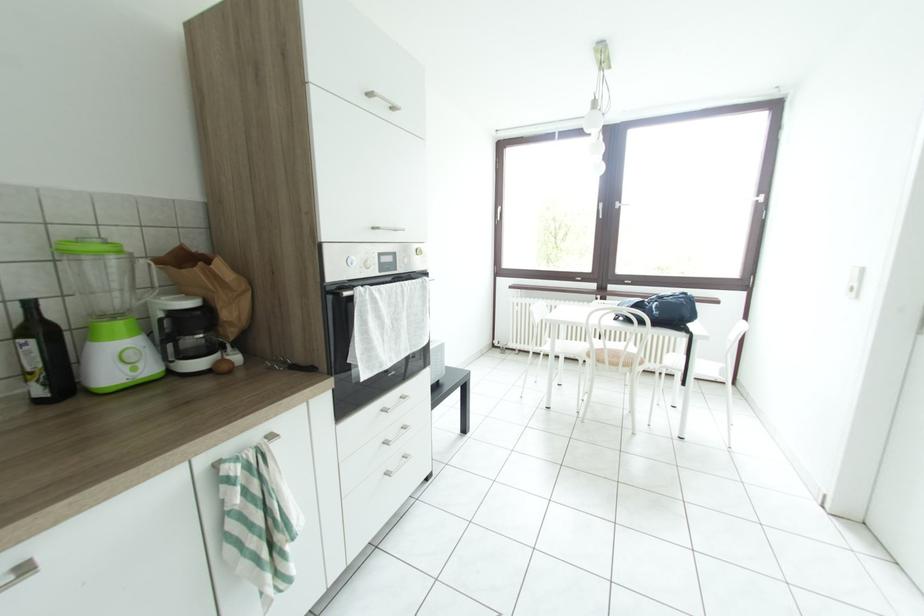
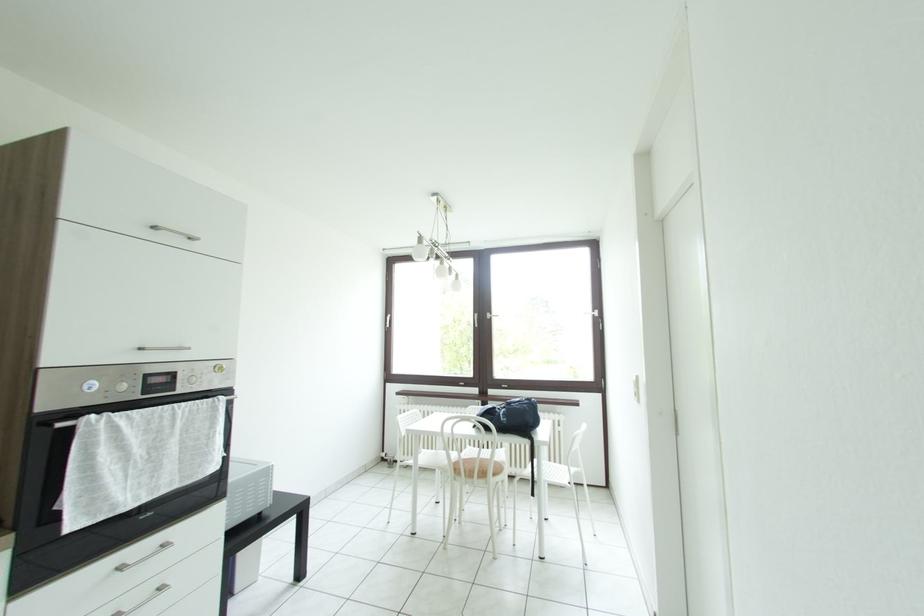
Question: Based on the continuous images, in which direction is the camera rotating? Reply with the corresponding letter.

Choices:
 (A) Left
 (B) Right
 (C) Up
 (D) Down

Answer: (C)